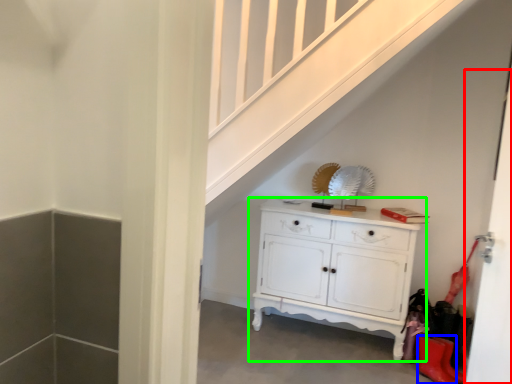
Question: Estimate the real-world distances between objects in this image. Which object is closer to door (highlighted by a red box), shoe (highlighted by a blue box) or chest of drawers (highlighted by a green box)?

Choices:
 (A) shoe
 (B) chest of drawers

Answer: (B)